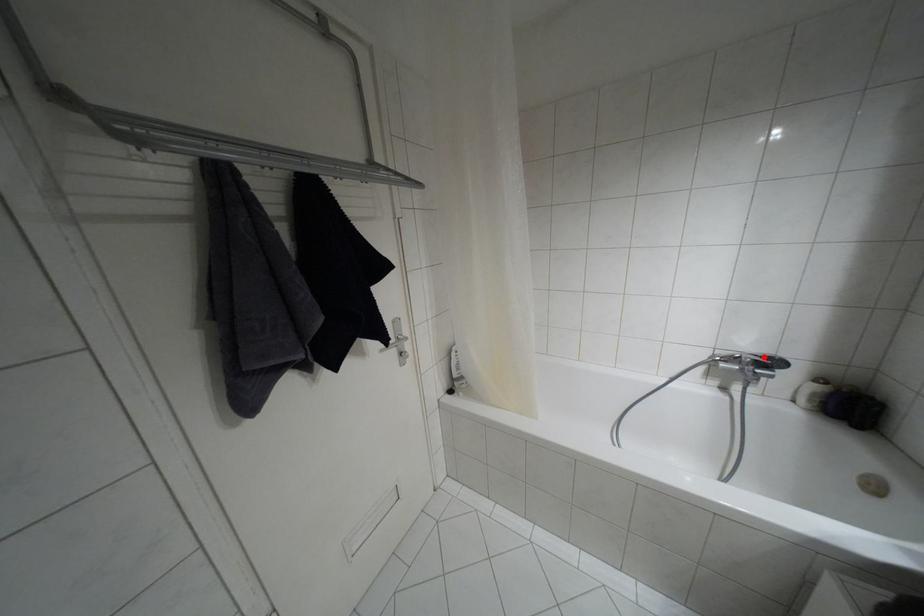
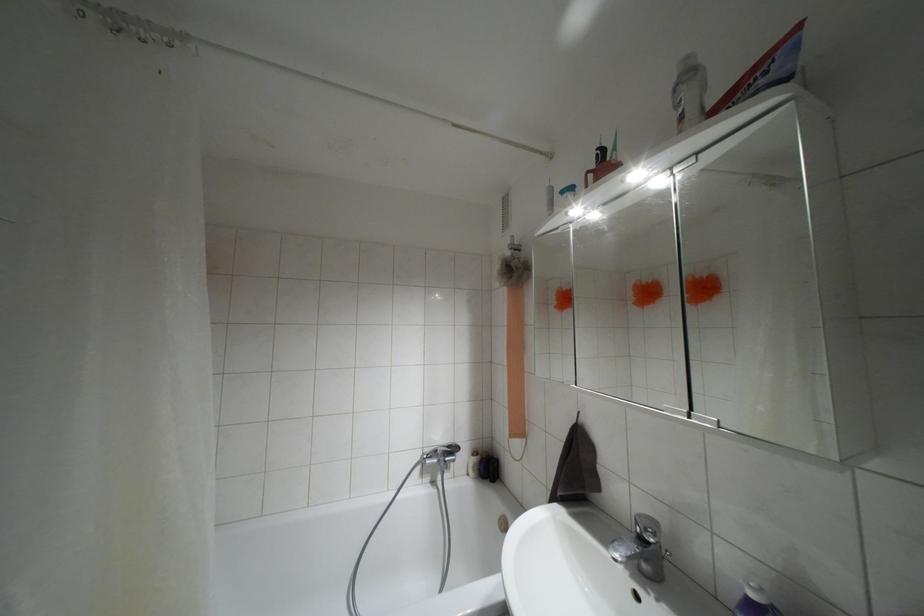
The point at the highlighted location is marked in the first image. Where is the corresponding point in the second image?

(447, 446)